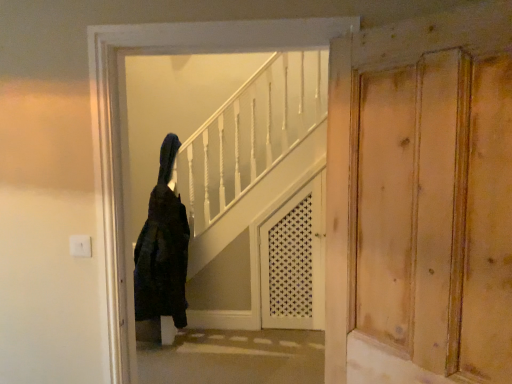
Question: Considering the relative sizes of white lattice screen door at center and black fuzzy coat at center in the image provided, is white lattice screen door at center bigger than black fuzzy coat at center?

Choices:
 (A) yes
 (B) no

Answer: (B)

Question: Can you confirm if white lattice screen door at center is shorter than black fuzzy coat at center?

Choices:
 (A) yes
 (B) no

Answer: (B)

Question: Does white lattice screen door at center have a smaller size compared to black fuzzy coat at center?

Choices:
 (A) no
 (B) yes

Answer: (B)

Question: Is white lattice screen door at center touching black fuzzy coat at center?

Choices:
 (A) yes
 (B) no

Answer: (B)

Question: Is white lattice screen door at center positioned behind black fuzzy coat at center?

Choices:
 (A) no
 (B) yes

Answer: (B)

Question: Is natural wood door at right inside or outside of white lattice screen door at center?

Choices:
 (A) inside
 (B) outside

Answer: (B)

Question: In terms of height, does natural wood door at right look taller or shorter compared to white lattice screen door at center?

Choices:
 (A) short
 (B) tall

Answer: (A)

Question: Considering the positions of natural wood door at right and white lattice screen door at center in the image, is natural wood door at right wider or thinner than white lattice screen door at center?

Choices:
 (A) thin
 (B) wide

Answer: (A)

Question: From a real-world perspective, is natural wood door at right positioned above or below white lattice screen door at center?

Choices:
 (A) above
 (B) below

Answer: (A)

Question: Does point (159, 269) appear closer or farther from the camera than point (295, 258)?

Choices:
 (A) closer
 (B) farther

Answer: (A)

Question: Is black fuzzy coat at center bigger or smaller than white lattice screen door at center?

Choices:
 (A) big
 (B) small

Answer: (A)

Question: From the image's perspective, is black fuzzy coat at center above or below white lattice screen door at center?

Choices:
 (A) below
 (B) above

Answer: (B)

Question: Relative to white lattice screen door at center, is black fuzzy coat at center in front or behind?

Choices:
 (A) front
 (B) behind

Answer: (A)

Question: Relative to black fuzzy coat at center, is white lattice screen door at center in front or behind?

Choices:
 (A) front
 (B) behind

Answer: (B)

Question: Which is correct: white lattice screen door at center is inside black fuzzy coat at center, or outside of it?

Choices:
 (A) outside
 (B) inside

Answer: (A)